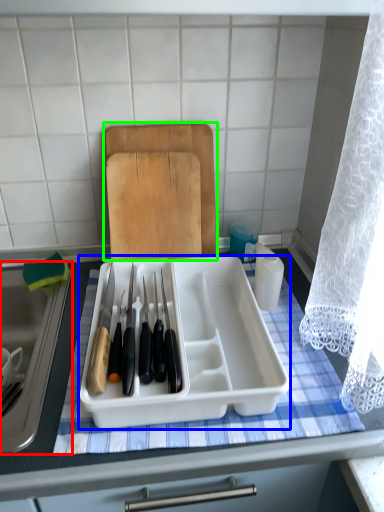
Question: Based on their relative distances, which object is nearer to sink (highlighted by a red box)? Choose from kitchen appliance (highlighted by a blue box) and cutting board (highlighted by a green box).

Choices:
 (A) kitchen appliance
 (B) cutting board

Answer: (A)